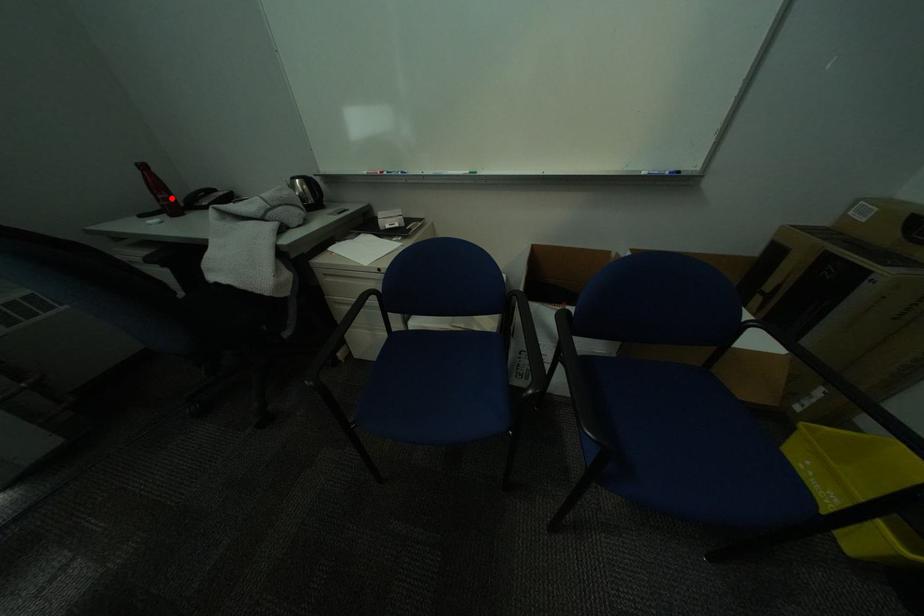
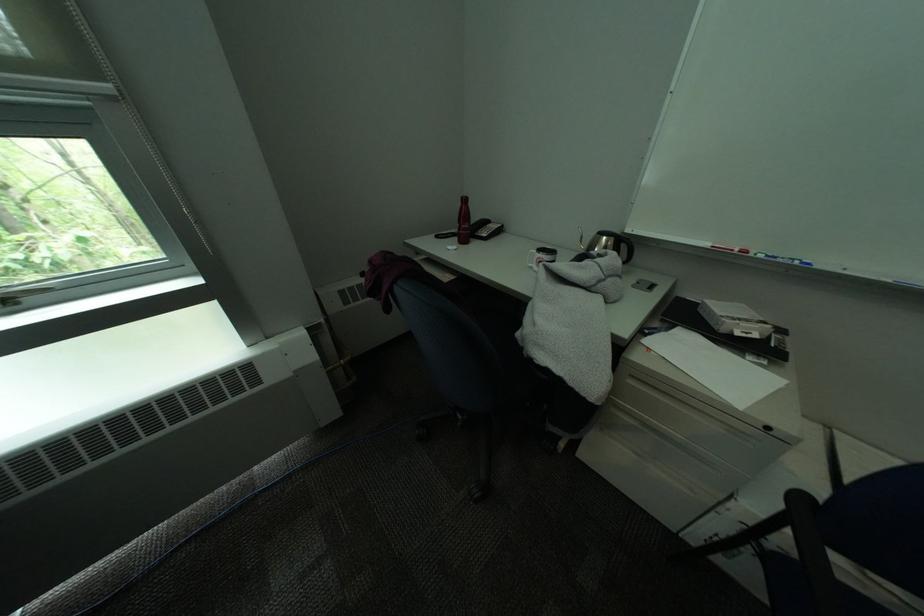
Question: I am providing you with two images of the same scene from different viewpoints. In image1, a red point is highlighted. Considering the same 3D point in image2, which of the following is correct?

Choices:
 (A) It is closer
 (B) It is farther

Answer: (A)